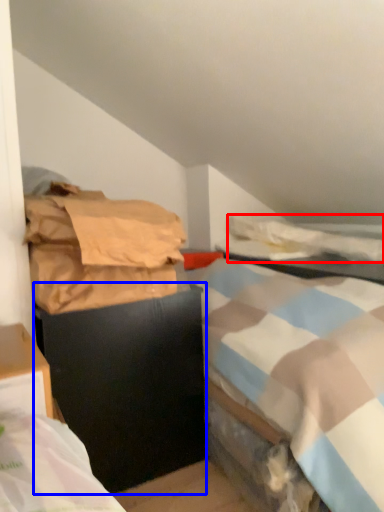
Question: Which object appears farthest to the camera in this image, blanket (highlighted by a red box) or furniture (highlighted by a blue box)?

Choices:
 (A) blanket
 (B) furniture

Answer: (A)